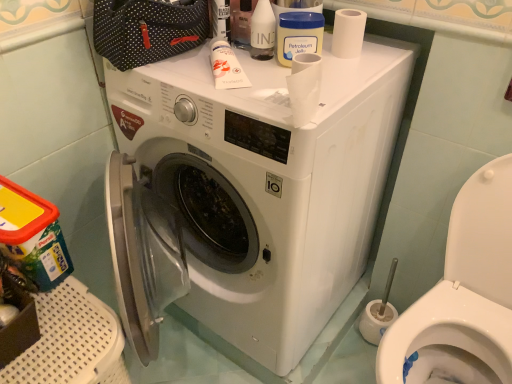
Question: Is the depth of translucent plastic bottle at upper center, acting as the second toiletry starting from the left, less than that of white matte toilet paper at upper right?

Choices:
 (A) yes
 (B) no

Answer: (A)

Question: Is translucent plastic bottle at upper center, which ranks as the first toiletry in right-to-left order, far away from white matte toilet paper at upper right?

Choices:
 (A) yes
 (B) no

Answer: (B)

Question: From the image's perspective, would you say translucent plastic bottle at upper center, which appears as the 1th toiletry when viewed from the top, is positioned over white matte toilet paper at upper right?

Choices:
 (A) yes
 (B) no

Answer: (A)

Question: Can you see translucent plastic bottle at upper center, the 2th toiletry in the bottom-to-top sequence, touching white matte toilet paper at upper right?

Choices:
 (A) yes
 (B) no

Answer: (B)

Question: From a real-world perspective, is translucent plastic bottle at upper center, the 2th toiletry in the bottom-to-top sequence, below white matte toilet paper at upper right?

Choices:
 (A) yes
 (B) no

Answer: (B)

Question: Does point (334, 24) appear closer or farther from the camera than point (260, 3)?

Choices:
 (A) farther
 (B) closer

Answer: (A)

Question: Is white matte toilet paper at upper right wider or thinner than translucent plastic bottle at upper center, which ranks as the first toiletry in right-to-left order?

Choices:
 (A) thin
 (B) wide

Answer: (B)

Question: Is white matte toilet paper at upper right taller or shorter than translucent plastic bottle at upper center, acting as the second toiletry starting from the left?

Choices:
 (A) short
 (B) tall

Answer: (A)

Question: Do you think white matte toilet paper at upper right is within translucent plastic bottle at upper center, acting as the second toiletry starting from the left, or outside of it?

Choices:
 (A) outside
 (B) inside

Answer: (A)

Question: Does point (236, 140) appear closer or farther from the camera than point (258, 43)?

Choices:
 (A) closer
 (B) farther

Answer: (A)

Question: From the image's perspective, is white plastic washing machine at center above or below translucent plastic bottle at upper center, the 2th toiletry in the bottom-to-top sequence?

Choices:
 (A) above
 (B) below

Answer: (B)

Question: Is white plastic washing machine at center spatially inside translucent plastic bottle at upper center, which ranks as the first toiletry in right-to-left order, or outside of it?

Choices:
 (A) outside
 (B) inside

Answer: (A)

Question: Based on their positions, is white plastic washing machine at center located to the left or right of translucent plastic bottle at upper center, the 2th toiletry in the bottom-to-top sequence?

Choices:
 (A) left
 (B) right

Answer: (A)

Question: Does point (266, 46) appear closer or farther from the camera than point (222, 71)?

Choices:
 (A) farther
 (B) closer

Answer: (A)

Question: Considering the positions of translucent plastic bottle at upper center, acting as the second toiletry starting from the left, and white matte tube at upper center, which is the first toiletry from left to right, in the image, is translucent plastic bottle at upper center, acting as the second toiletry starting from the left, taller or shorter than white matte tube at upper center, which is the first toiletry from left to right,?

Choices:
 (A) tall
 (B) short

Answer: (A)